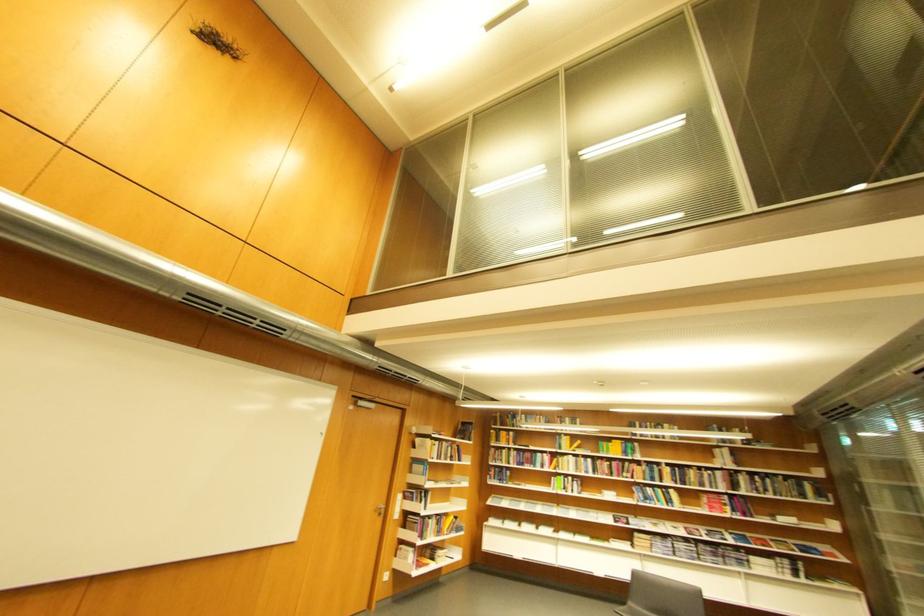
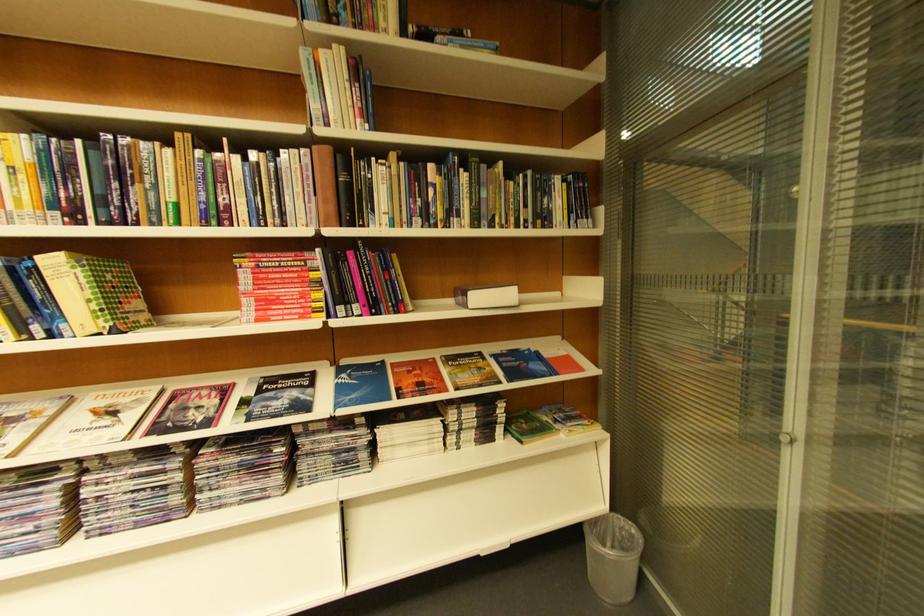
The point at [682,493] is marked in the first image. Where is the corresponding point in the second image?

(63, 264)